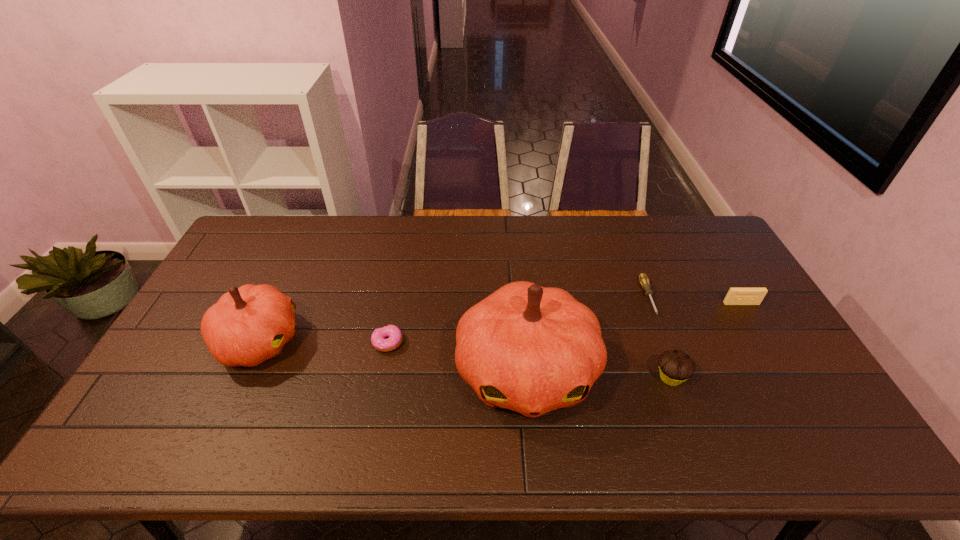
Locate an element on the screen. vacant position at the near edge of the desktop is located at coordinates (356, 418).

This screenshot has width=960, height=540. What are the coordinates of `blank space at the left edge` in the screenshot? It's located at (219, 271).

In the image, there is a desktop. What are the coordinates of `vacant space at the right edge` in the screenshot? It's located at (742, 348).

Identify the location of free space at the far left corner of the desktop. This screenshot has width=960, height=540. pos(244,246).

This screenshot has width=960, height=540. Find the location of `vacant area at the far right corner`. vacant area at the far right corner is located at coordinates (684, 253).

The height and width of the screenshot is (540, 960). I want to click on free space between the tallest object and the third shortest object, so click(634, 338).

At what (x,y) coordinates should I click in order to perform the action: click on vacant area that lies between the screwdriver and the leftmost object. Please return your answer as a coordinate pair (x, y). The width and height of the screenshot is (960, 540). Looking at the image, I should click on tap(454, 319).

At what (x,y) coordinates should I click in order to perform the action: click on object that is the fourth closest to the fourth shortest object. Please return your answer as a coordinate pair (x, y). The image size is (960, 540). Looking at the image, I should click on [378, 341].

Select which object appears as the second closest to the shortest object. Please provide its 2D coordinates. Your answer should be formatted as a tuple, i.e. [(x, y)], where the tuple contains the x and y coordinates of a point satisfying the conditions above.

[(531, 349)]

This screenshot has width=960, height=540. In order to click on vacant space that satisfies the following two spatial constraints: 1. at the front of the fourth tallest object with spools; 2. on the front-facing side of the shorter pumpkin in this screenshot , I will do `click(764, 341)`.